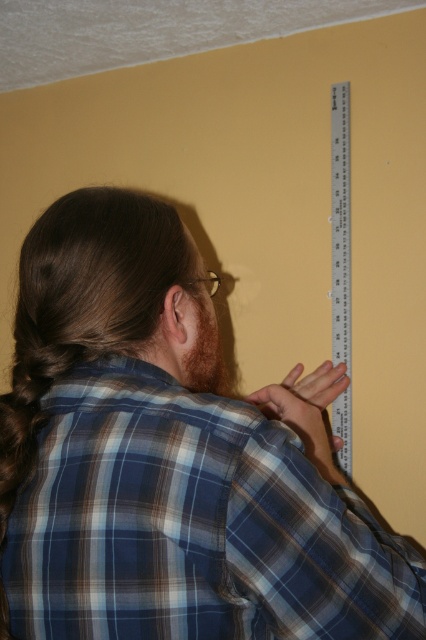
Question: Which point is farther to the camera?

Choices:
 (A) (203, 369)
 (B) (115, 205)
 (C) (336, 349)

Answer: (C)

Question: Which object is farther from the camera taking this photo?

Choices:
 (A) brown fuzzy beard at back
 (B) clear plastic ruler at upper right
 (C) blue plaid shirt at upper center

Answer: (B)

Question: Can you confirm if blue plaid shirt at upper center is wider than brown fuzzy beard at back?

Choices:
 (A) yes
 (B) no

Answer: (A)

Question: Considering the real-world distances, which object is farthest from the brown fuzzy beard at back?

Choices:
 (A) clear plastic ruler at upper right
 (B) blue plaid shirt at upper center

Answer: (A)

Question: Where is clear plastic ruler at upper right located in relation to brown fuzzy beard at back in the image?

Choices:
 (A) above
 (B) below

Answer: (A)

Question: Does blue plaid shirt at upper center appear over clear plastic ruler at upper right?

Choices:
 (A) no
 (B) yes

Answer: (A)